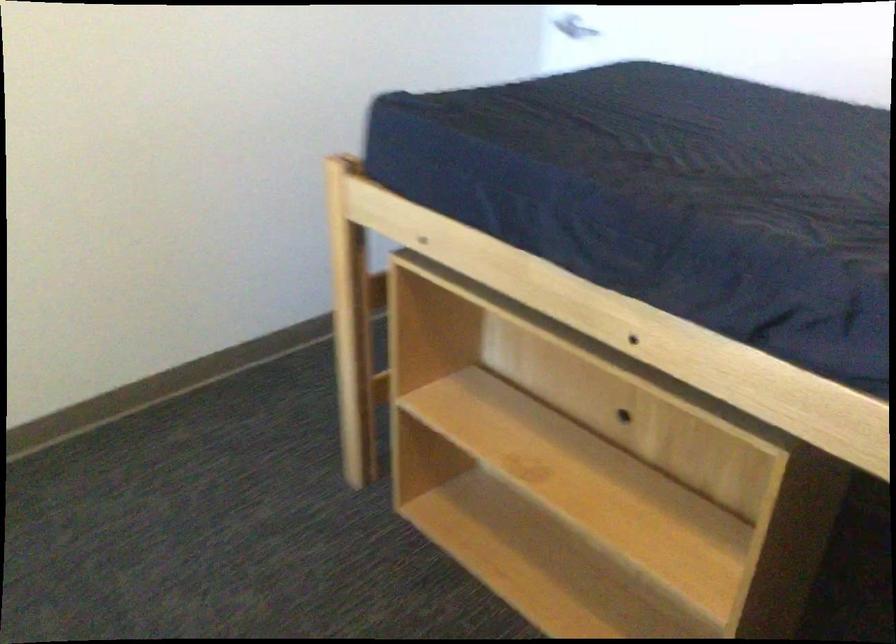
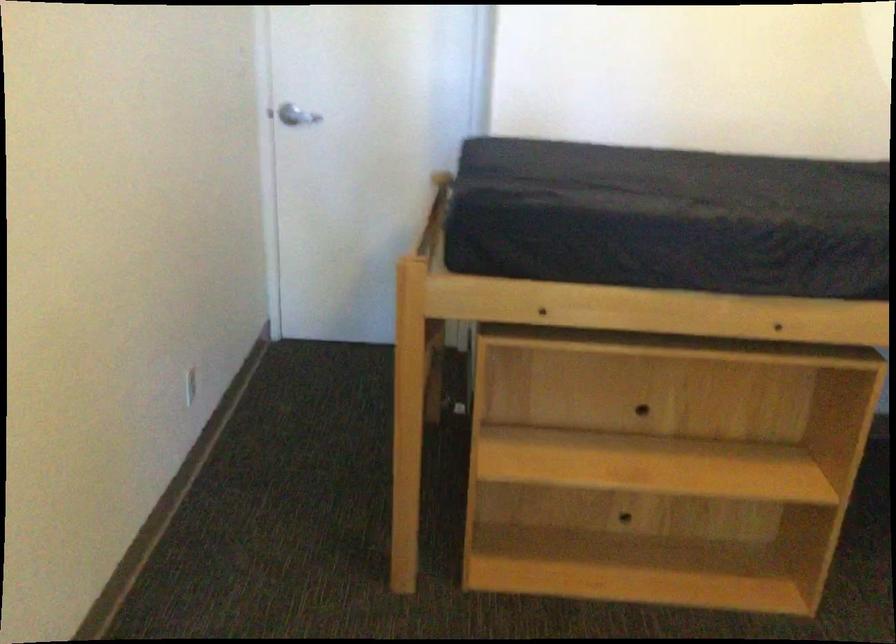
In the second image, find the point that corresponds to point 613,399 in the first image.

(633, 395)